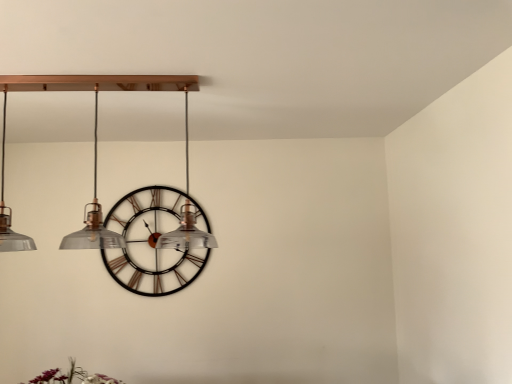
Question: Would you say matte glass chandelier at upper center is to the left or to the right of metallic black clock at center in the picture?

Choices:
 (A) left
 (B) right

Answer: (B)

Question: Considering the positions of matte glass chandelier at upper center and metallic black clock at center in the image, is matte glass chandelier at upper center taller or shorter than metallic black clock at center?

Choices:
 (A) short
 (B) tall

Answer: (A)

Question: Is point (5, 240) positioned closer to the camera than point (141, 205)?

Choices:
 (A) closer
 (B) farther

Answer: (A)

Question: Would you say metallic black clock at center is to the left or to the right of matte glass chandelier at upper center in the picture?

Choices:
 (A) right
 (B) left

Answer: (B)

Question: Relative to matte glass chandelier at upper center, is metallic black clock at center in front or behind?

Choices:
 (A) front
 (B) behind

Answer: (B)

Question: Is metallic black clock at center taller or shorter than matte glass chandelier at upper center?

Choices:
 (A) short
 (B) tall

Answer: (B)

Question: From a real-world perspective, is metallic black clock at center above or below matte glass chandelier at upper center?

Choices:
 (A) above
 (B) below

Answer: (B)